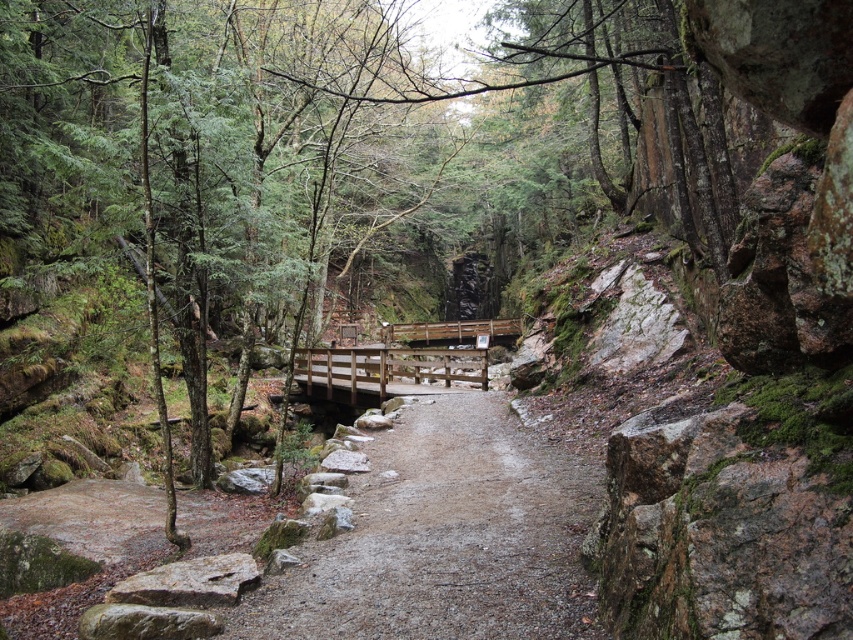
In the scene shown: You are a hiker trying to cross the wooden bridge at center. Based on the coordinates provided, can you determine if the bridge is positioned in the exact center of the image?

The wooden bridge at center is located at coordinates point (405, 356), which is close to the center but not exactly at the mathematical center of the image. Therefore, the bridge is positioned near the center but not precisely at the exact center.

You are a hiker carrying a heavy backpack and need to cross the wooden bridge in the forest scene. The bridge is narrow and surrounded by large rocks. There is a specific point marked at coordinates (445, 538). What is the nature of the terrain at this point?

The point at coordinates (445, 538) corresponds to damp gravel path at center, indicating that the terrain there is a damp gravel path.

You are a hiker carrying a heavy backpack and need to cross the wooden bridge. You notice the damp gravel path at center and the gray rough rock at lower left. Which of these two features is higher in elevation?

The damp gravel path at center has a greater height compared to the gray rough rock at lower left, so the damp gravel path at center is higher in elevation.